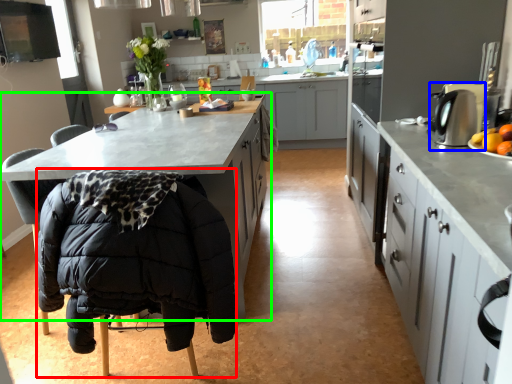
Question: Based on their relative distances, which object is nearer to folding chair (highlighted by a red box)? Choose from kitchen appliance (highlighted by a blue box) and cabinetry (highlighted by a green box).

Choices:
 (A) kitchen appliance
 (B) cabinetry

Answer: (B)